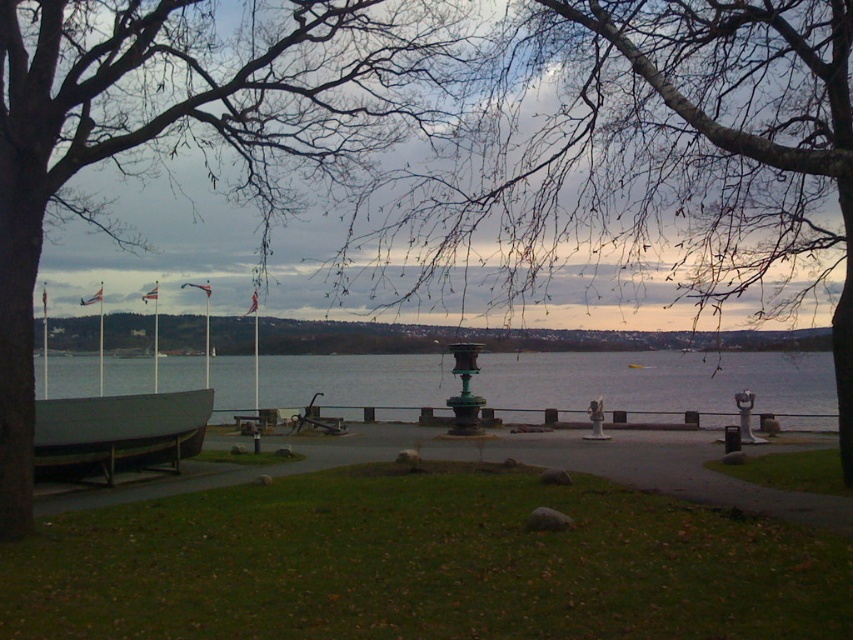
Question: Does dark brown bark tree at left lie behind clear water at center?

Choices:
 (A) no
 (B) yes

Answer: (A)

Question: Which point appears closest to the camera in this image?

Choices:
 (A) (148, 369)
 (B) (28, 340)
 (C) (759, 102)
 (D) (62, 419)

Answer: (B)

Question: Which point is closer to the camera taking this photo?

Choices:
 (A) (822, 163)
 (B) (821, 387)

Answer: (A)

Question: Is dark brown bark tree at left bigger than matte gray boat at lower left?

Choices:
 (A) no
 (B) yes

Answer: (B)

Question: Is dark brown bark tree at left thinner than matte gray boat at lower left?

Choices:
 (A) no
 (B) yes

Answer: (A)

Question: Among these objects, which one is farthest from the camera?

Choices:
 (A) matte gray boat at lower left
 (B) bare branches at center
 (C) clear water at center

Answer: (C)